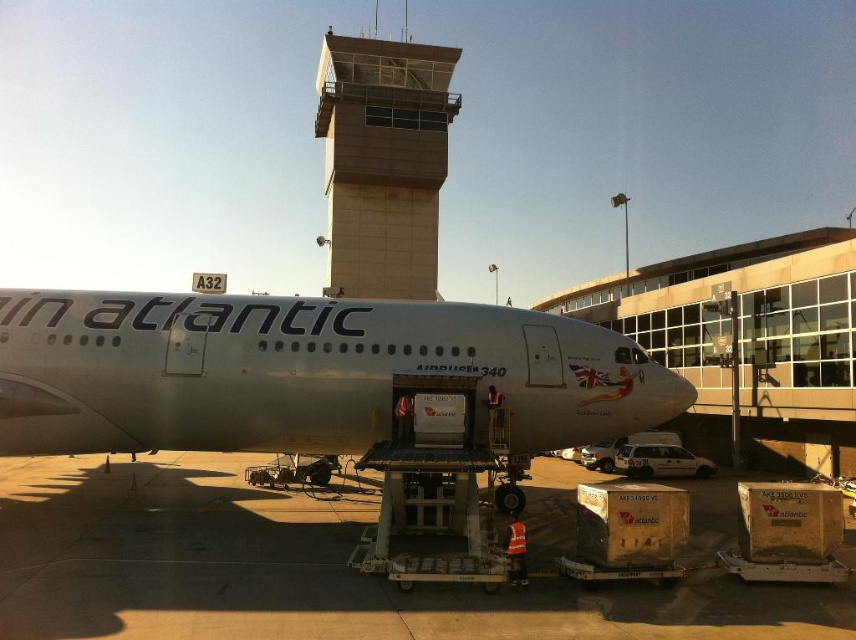
You are a luggage cart driver at the airport. You need to move from the white glossy tarmac at lower center to the terminal building. However, there is a white glossy airplane at center blocking your path. Can you go around the airplane on the right side to reach the terminal?

The white glossy tarmac at lower center is to the left of the white glossy airplane at center, so you can go around the airplane on the right side to reach the terminal.